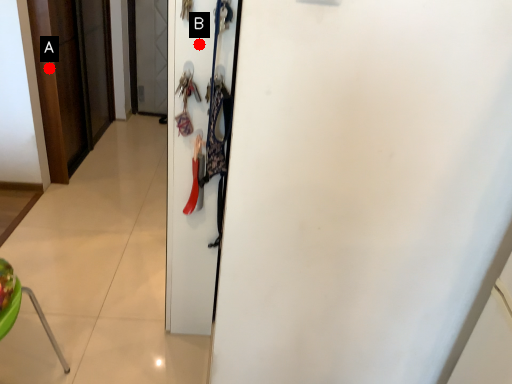
Question: Two points are circled on the image, labeled by A and B beside each circle. Which of the following is the closest to the observer?

Choices:
 (A) A is closer
 (B) B is closer

Answer: (B)